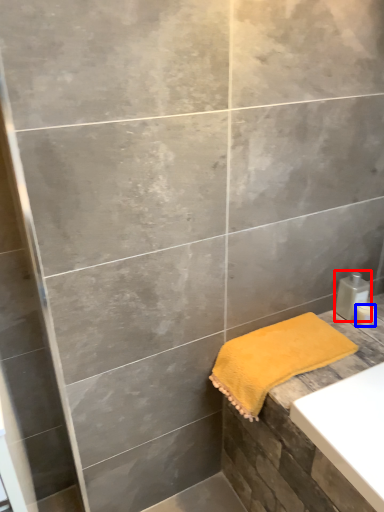
Question: Which point is closer to the camera, soap dispenser (highlighted by a red box) or toiletry (highlighted by a blue box)?

Choices:
 (A) soap dispenser
 (B) toiletry

Answer: (A)